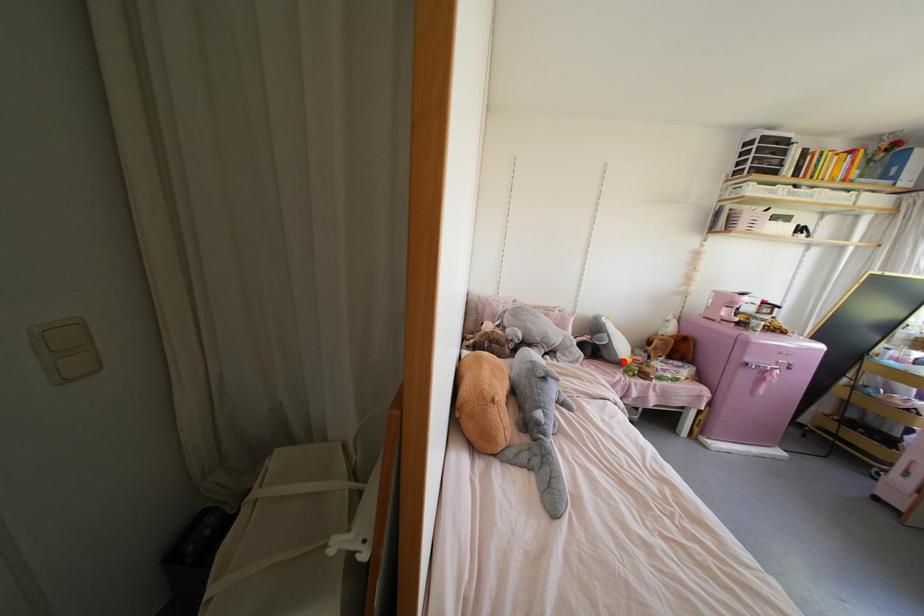
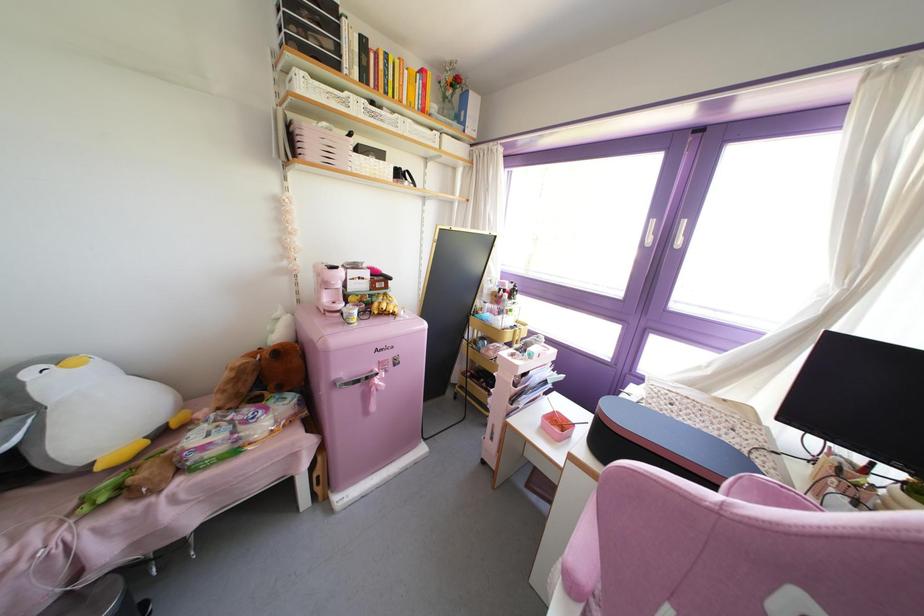
Question: I am providing you with two images of the same scene from different viewpoints. A red point is shown in image1. For the corresponding object point in image2, is it positioned nearer or farther from the camera?

Choices:
 (A) Nearer
 (B) Farther

Answer: (A)